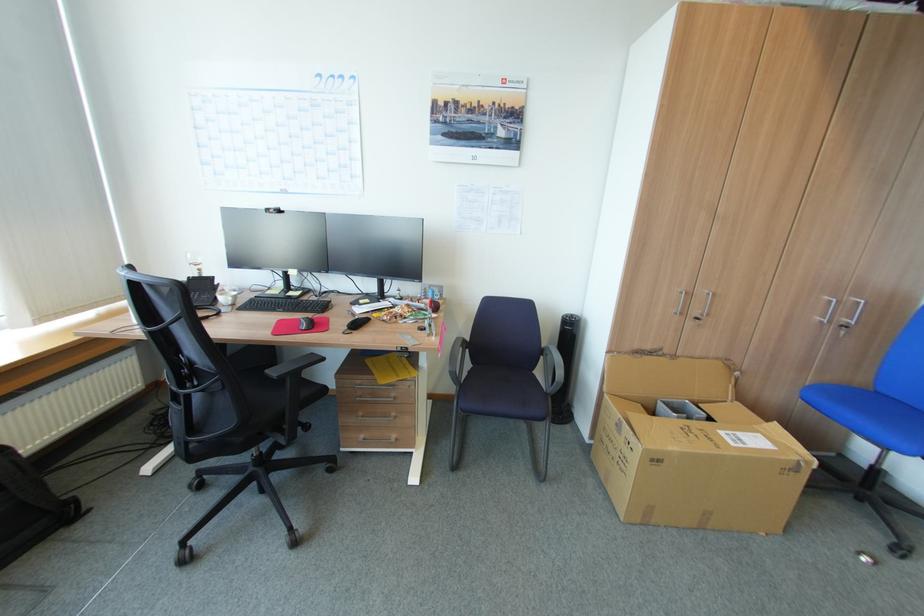
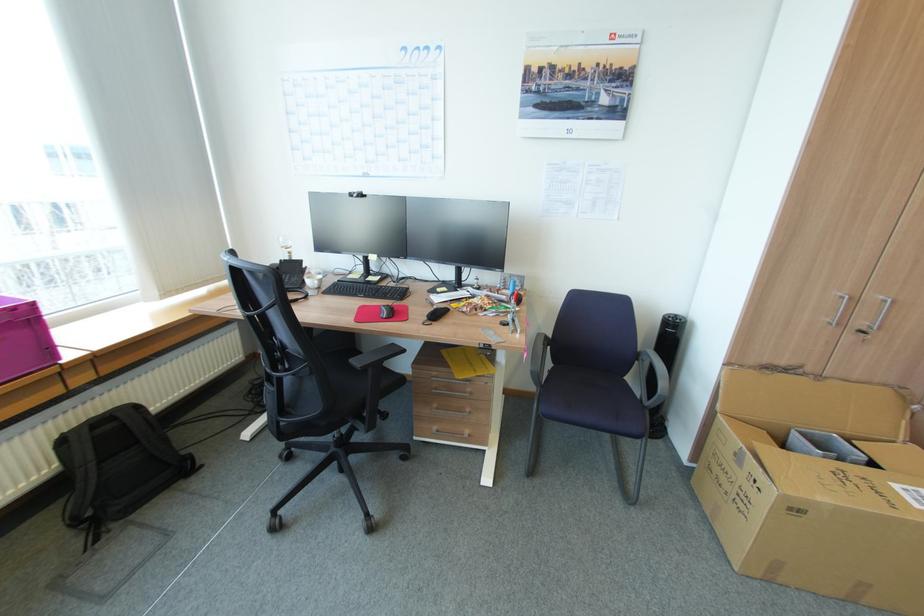
Find the pixel in the second image that matches (361,386) in the first image.

(438, 378)